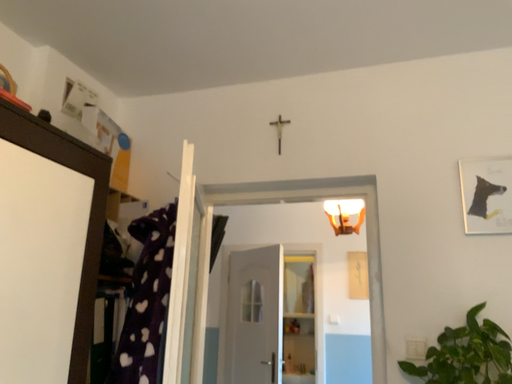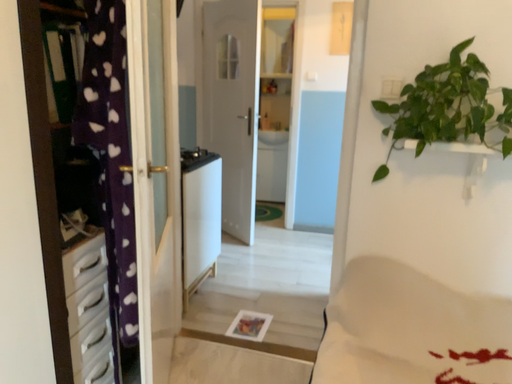
Question: How did the camera likely rotate when shooting the video?

Choices:
 (A) rotated downward
 (B) rotated upward

Answer: (A)